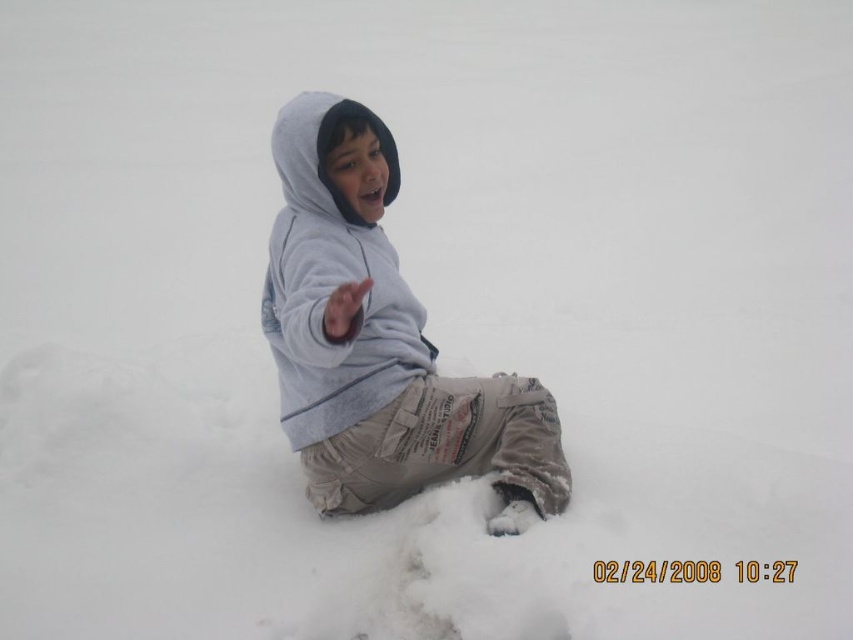
Question: Which point is farther to the camera?

Choices:
 (A) matte gray hoodie at center
 (B) gray fleece sweatshirt at center

Answer: (B)

Question: Is matte gray hoodie at center wider than gray fleece sweatshirt at center?

Choices:
 (A) no
 (B) yes

Answer: (B)

Question: Does matte gray hoodie at center appear under gray fleece sweatshirt at center?

Choices:
 (A) no
 (B) yes

Answer: (A)

Question: Can you confirm if matte gray hoodie at center is smaller than gray fleece sweatshirt at center?

Choices:
 (A) no
 (B) yes

Answer: (A)

Question: Which of the following is the closest to the observer?

Choices:
 (A) gray fleece sweatshirt at center
 (B) matte gray hoodie at center

Answer: (B)